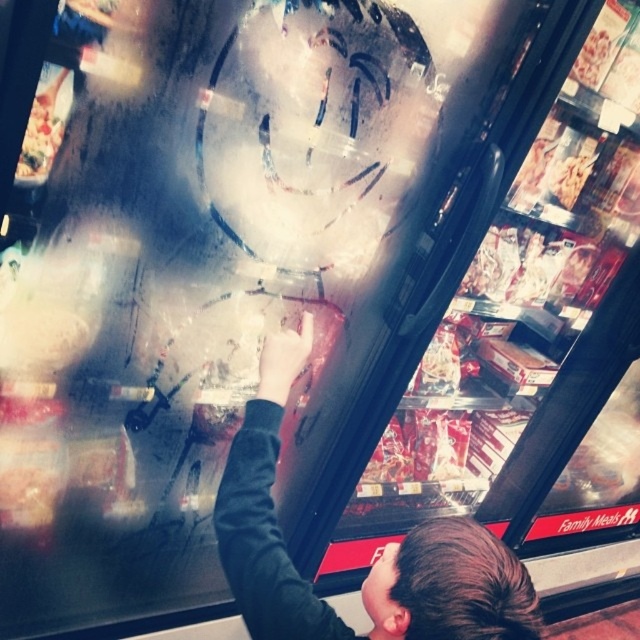
You are a customer in the grocery store freezer section. You see the black fabric at center and the white cardboard box at upper left. Which object is nearer to you?

The black fabric at center is closer to the viewer than the white cardboard box at upper left.

You are a store employee checking the freezer section. You notice the black fabric at center and the white cardboard box at upper left. Which object is located to the right of the other?

The black fabric at center is positioned on the right side of white cardboard box at upper left.